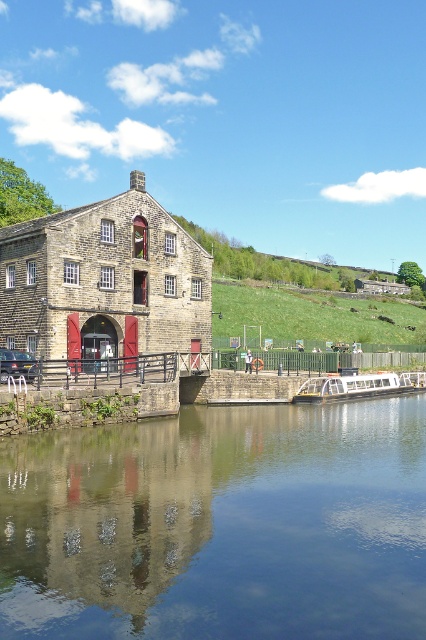
Based on the photo, is transparent glass water at center taller than white glossy boat at lower center?

Indeed, transparent glass water at center has a greater height compared to white glossy boat at lower center.

Does transparent glass water at center appear under white glossy boat at lower center?

Correct, transparent glass water at center is located below white glossy boat at lower center.

The image size is (426, 640). What are the coordinates of `transparent glass water at center` in the screenshot? It's located at (218, 525).